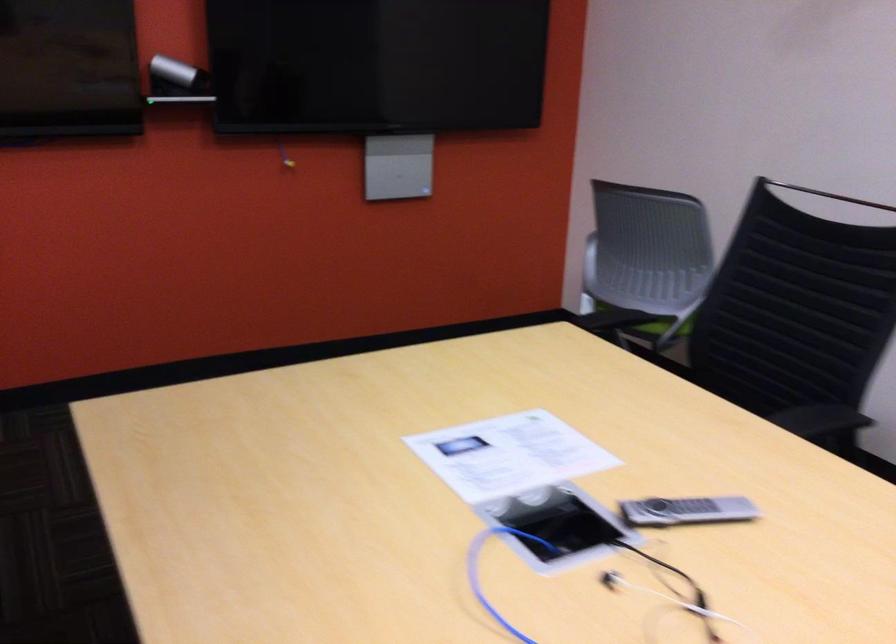
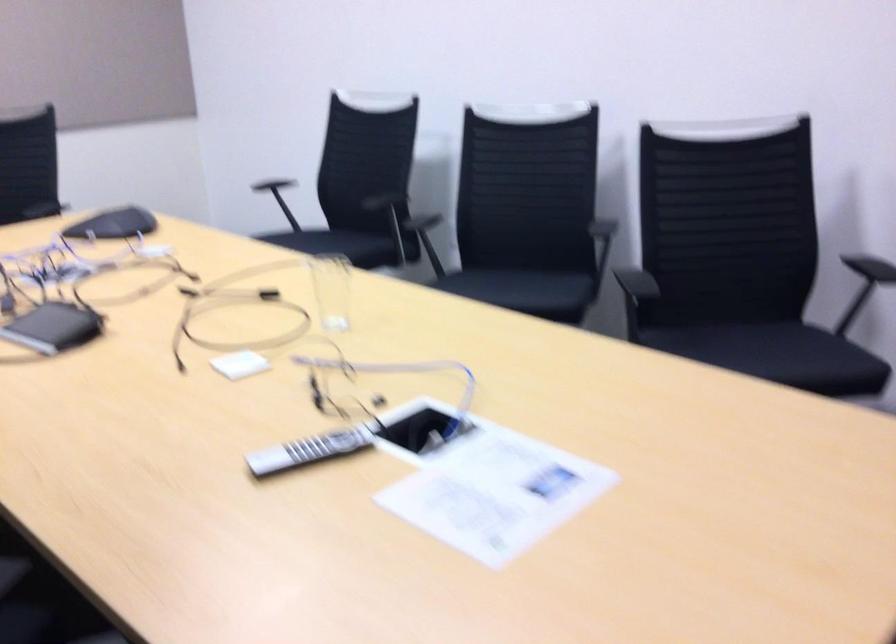
Locate, in the second image, the point that corresponds to (x=668, y=498) in the first image.

(308, 450)